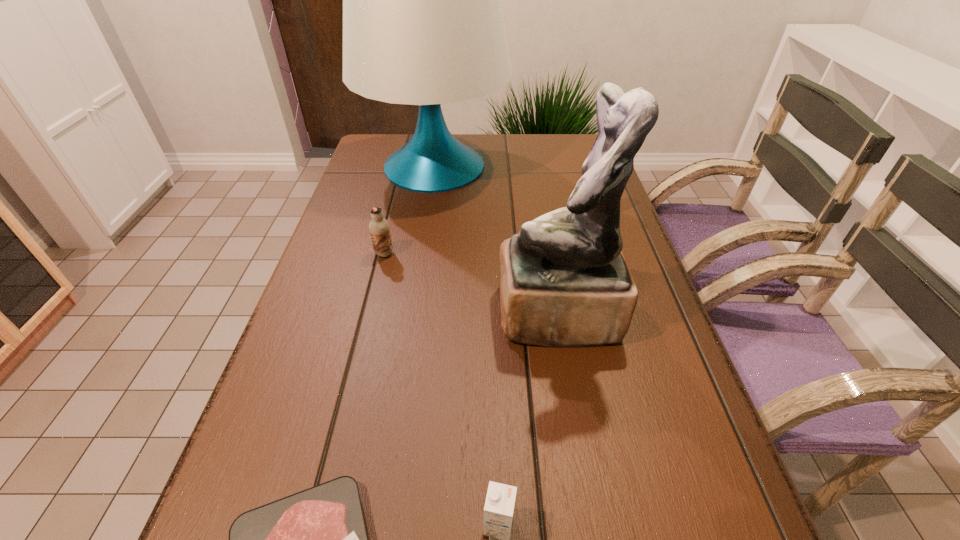
This screenshot has height=540, width=960. In order to click on the farthest object in this screenshot , I will do `click(423, 24)`.

Where is `the tallest object`? The height and width of the screenshot is (540, 960). the tallest object is located at coordinates (423, 24).

Locate an element on the screen. the second tallest object is located at coordinates (564, 282).

The height and width of the screenshot is (540, 960). Identify the location of sculpture. (564, 282).

The height and width of the screenshot is (540, 960). Identify the location of the left chocolate milk. (379, 228).

I want to click on the farther chocolate milk, so click(379, 228).

This screenshot has height=540, width=960. What are the coordinates of `free spot located on the front-facing side of the farthest object` in the screenshot? It's located at (426, 225).

The height and width of the screenshot is (540, 960). I want to click on vacant space located 0.360m in a relaxed pose on the third nearest object, so click(x=324, y=315).

Identify the location of vacant point located in a relaxed pose on the third nearest object. The width and height of the screenshot is (960, 540). (456, 315).

The width and height of the screenshot is (960, 540). What are the coordinates of `blank area located in a relaxed pose on the third nearest object` in the screenshot? It's located at (339, 315).